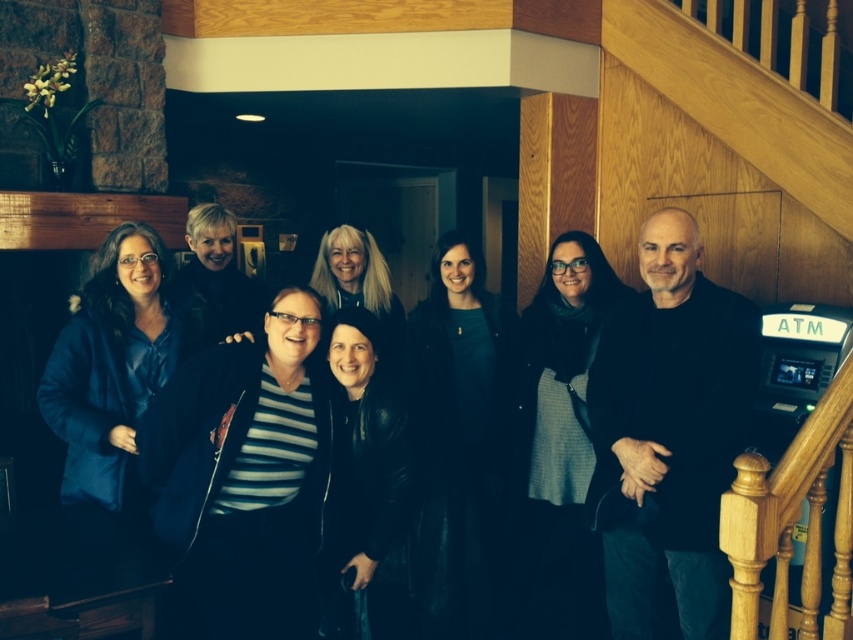
Which is below, dark blue jacket at center or black leather jacket at center?

dark blue jacket at center is below.

Is dark blue jacket at center shorter than black leather jacket at center?

In fact, dark blue jacket at center may be taller than black leather jacket at center.

The height and width of the screenshot is (640, 853). What are the coordinates of `dark blue jacket at center` in the screenshot? It's located at (631, 435).

This screenshot has height=640, width=853. What are the coordinates of `dark blue jacket at center` in the screenshot? It's located at (631, 435).

Who is more distant from viewer, (434, 525) or (99, 417)?

The point (99, 417) is behind.

Is dark blue leather jacket at center below matte blue jacket at left?

Yes.

This screenshot has width=853, height=640. What do you see at coordinates (457, 440) in the screenshot?
I see `dark blue leather jacket at center` at bounding box center [457, 440].

The width and height of the screenshot is (853, 640). In order to click on dark blue leather jacket at center in this screenshot , I will do `click(457, 440)`.

Is dark blue leather jacket at center bigger than black leather jacket at center?

Indeed, dark blue leather jacket at center has a larger size compared to black leather jacket at center.

Is dark blue leather jacket at center to the left of black leather jacket at center from the viewer's perspective?

In fact, dark blue leather jacket at center is to the right of black leather jacket at center.

Which is in front, point (445, 630) or point (339, 346)?

Point (339, 346)

Locate an element on the screen. dark blue leather jacket at center is located at coordinates (457, 440).